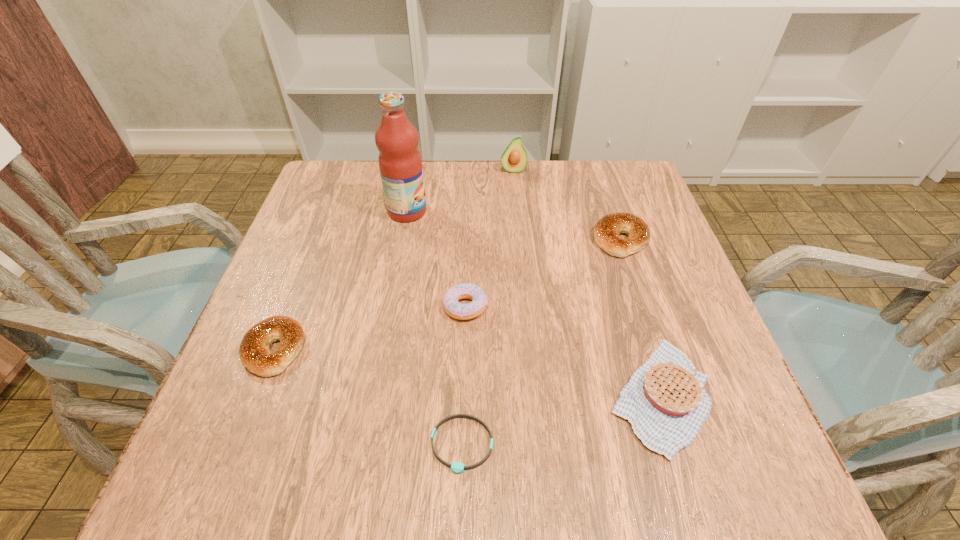
Locate an element on the screen. The height and width of the screenshot is (540, 960). object situated at the left edge is located at coordinates (255, 355).

Where is `bagel present at the right edge`? bagel present at the right edge is located at coordinates (606, 231).

Locate an element on the screen. The image size is (960, 540). pie located in the right edge section of the desktop is located at coordinates (665, 401).

What are the coordinates of `object that is at the near right corner` in the screenshot? It's located at (665, 401).

In the image, there is a desktop. At what (x,y) coordinates should I click in order to perform the action: click on vacant space at the far edge. Please return your answer as a coordinate pair (x, y). This screenshot has width=960, height=540. Looking at the image, I should click on (531, 164).

What are the coordinates of `vacant area at the near edge` in the screenshot? It's located at point(507,476).

In the image, there is a desktop. Where is `vacant space at the left edge`? vacant space at the left edge is located at coordinates (313, 227).

Find the location of a particular element. Image resolution: width=960 pixels, height=540 pixels. vacant space at the right edge is located at coordinates 664,238.

The height and width of the screenshot is (540, 960). In the image, there is a desktop. In order to click on free space at the far left corner in this screenshot , I will do `click(337, 173)`.

Image resolution: width=960 pixels, height=540 pixels. Identify the location of vacant space at the far right corner of the desktop. (621, 202).